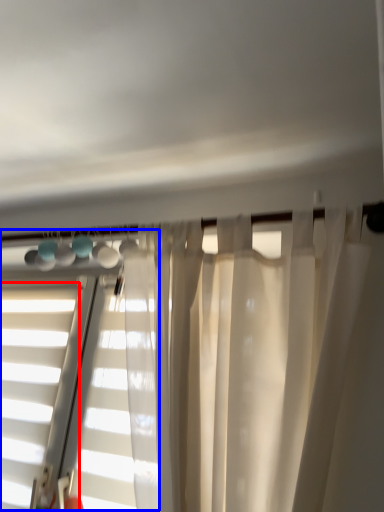
Question: Which point is closer to the camera, window (highlighted by a red box) or bay window (highlighted by a blue box)?

Choices:
 (A) window
 (B) bay window

Answer: (B)